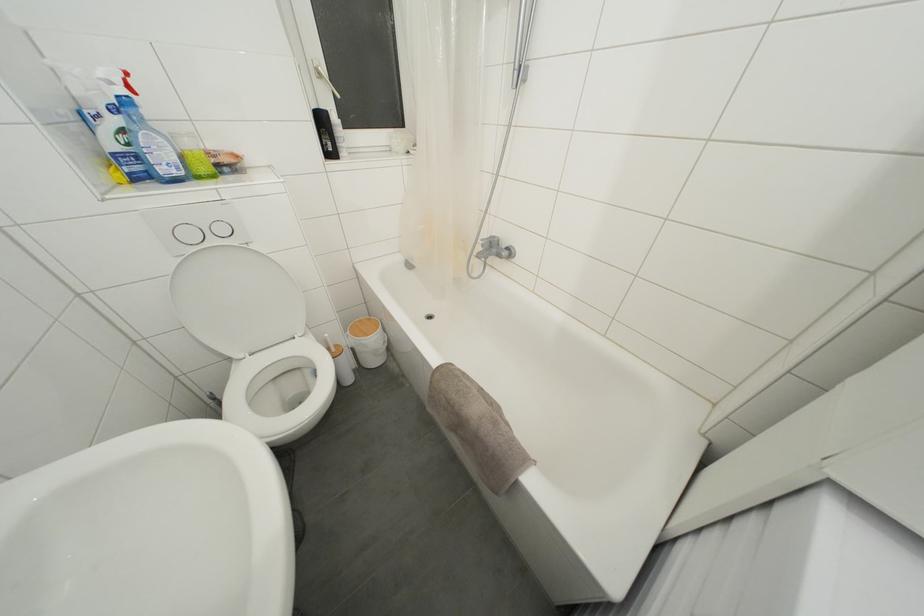
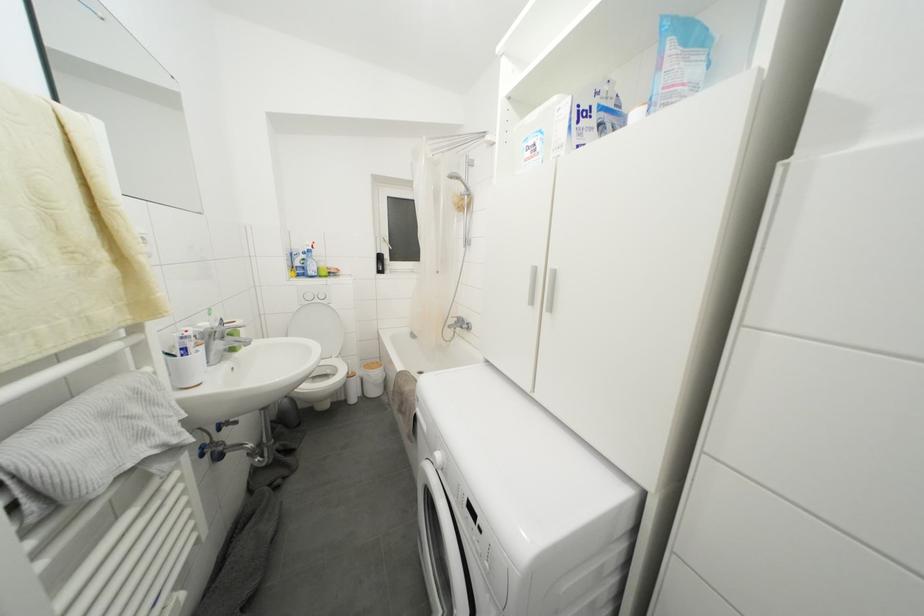
The images are taken continuously from a first-person perspective. In which direction are you moving?

The cameraman moved toward right, backward.